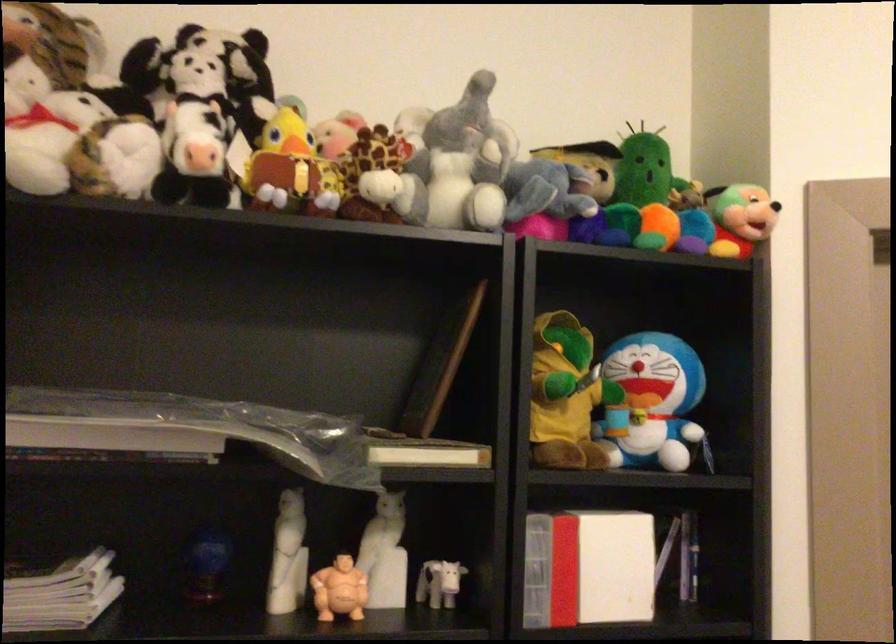
Locate an element on the screen. Image resolution: width=896 pixels, height=644 pixels. red and white book is located at coordinates (609, 565).